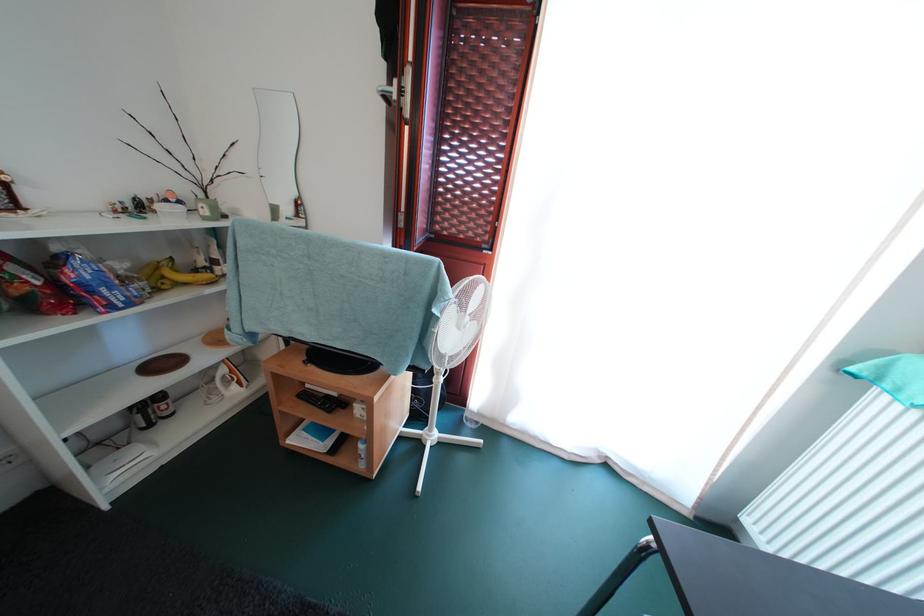
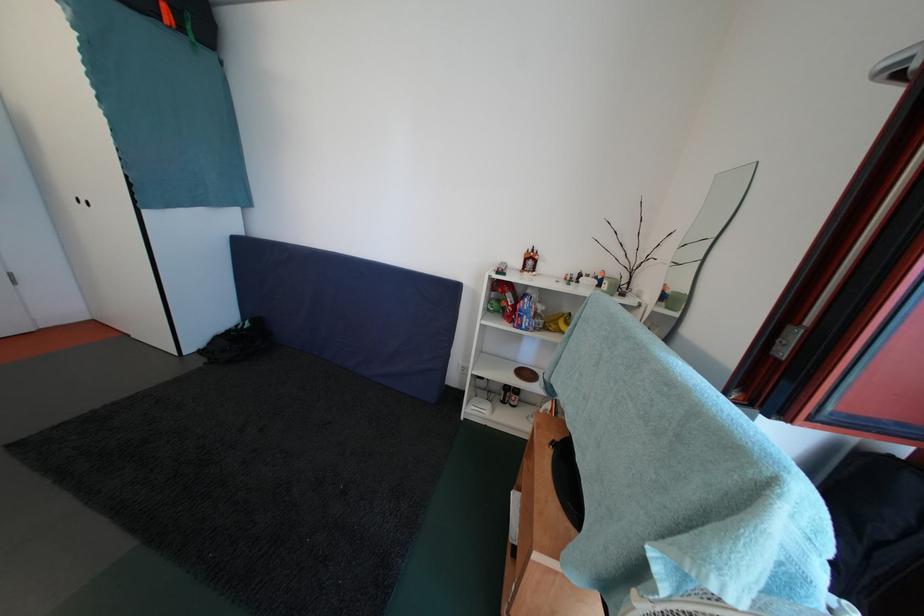
Question: The camera is either moving clockwise (left) or counter-clockwise (right) around the object. The first image is from the beginning of the video and the second image is from the end. Is the camera moving left or right when shooting the video?

Choices:
 (A) Left
 (B) Right

Answer: (B)